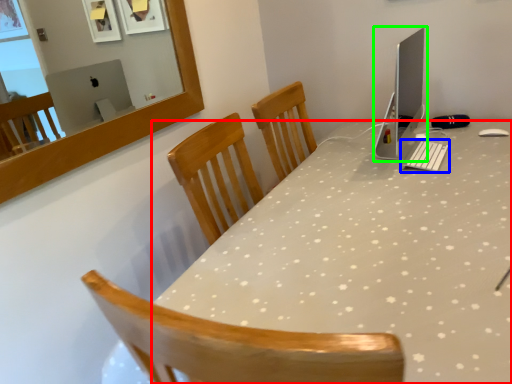
Question: Which object is positioned closest to desk (highlighted by a red box)? Select from keyboard (highlighted by a blue box) and computer monitor (highlighted by a green box).

Choices:
 (A) keyboard
 (B) computer monitor

Answer: (A)